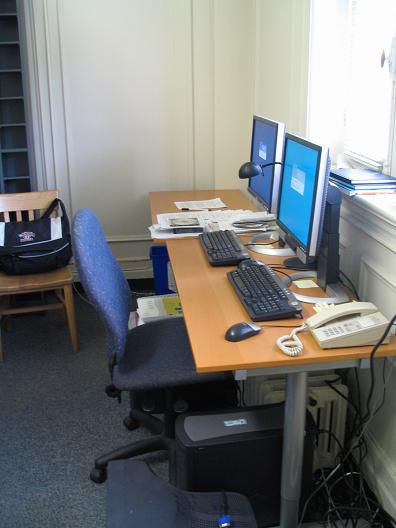
Find the location of a particular element. The width and height of the screenshot is (396, 528). cords is located at coordinates (335, 445), (349, 422), (359, 407), (371, 389), (383, 380), (381, 391), (331, 496), (349, 516).